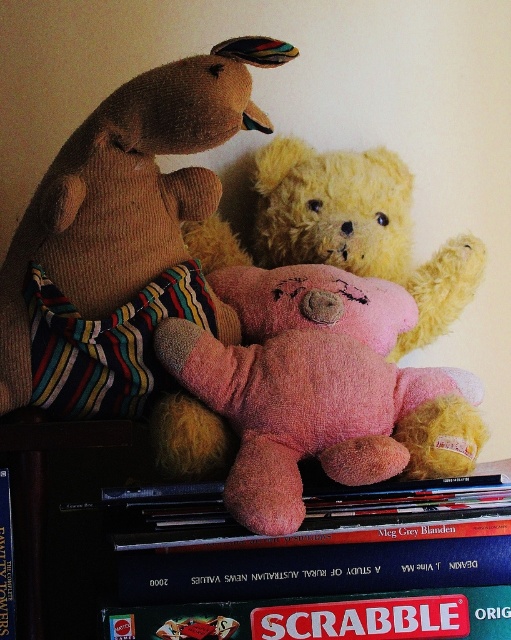
Does point (240, 547) come in front of point (151, 248)?

Yes, point (240, 547) is in front of point (151, 248).

Between point (150, 595) and point (190, 301), which one is positioned in front?

Point (150, 595) is more forward.

Image resolution: width=511 pixels, height=640 pixels. Identify the location of soft pink plush at upper center. (228, 540).

Which is in front, point (246, 595) or point (189, 385)?

Positioned in front is point (246, 595).

Can you confirm if soft pink plush at upper center is positioned to the right of fluffy pink teddy bear at center?

Incorrect, soft pink plush at upper center is not on the right side of fluffy pink teddy bear at center.

You are a GUI agent. You are given a task and a screenshot of the screen. Output one action in this format:
    pyautogui.click(x=<x>, y=<y>)
    Task: Click on the soft pink plush at upper center
    Image resolution: width=511 pixels, height=640 pixels.
    Given the screenshot: What is the action you would take?
    pyautogui.click(x=228, y=540)

Which of these two, soft brown stuffed animal at upper left or fluffy pink teddy bear at center, stands taller?

With more height is soft brown stuffed animal at upper left.

Is soft brown stuffed animal at upper left bigger than fluffy pink teddy bear at center?

No.

Is point (159, 208) more distant than point (231, 468)?

That is True.

Where is `soft brown stuffed animal at upper left`? soft brown stuffed animal at upper left is located at coordinates (123, 237).